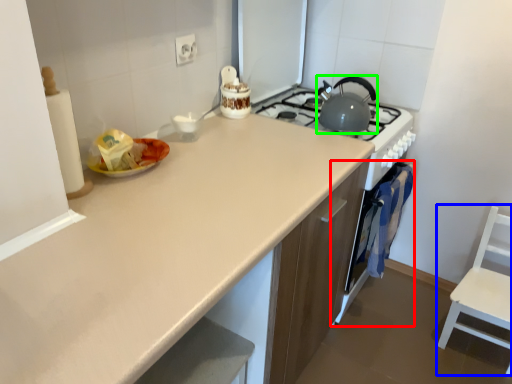
Question: Which object is positioned closest to oven (highlighted by a red box)? Select from chair (highlighted by a blue box) and kitchen appliance (highlighted by a green box).

Choices:
 (A) chair
 (B) kitchen appliance

Answer: (A)